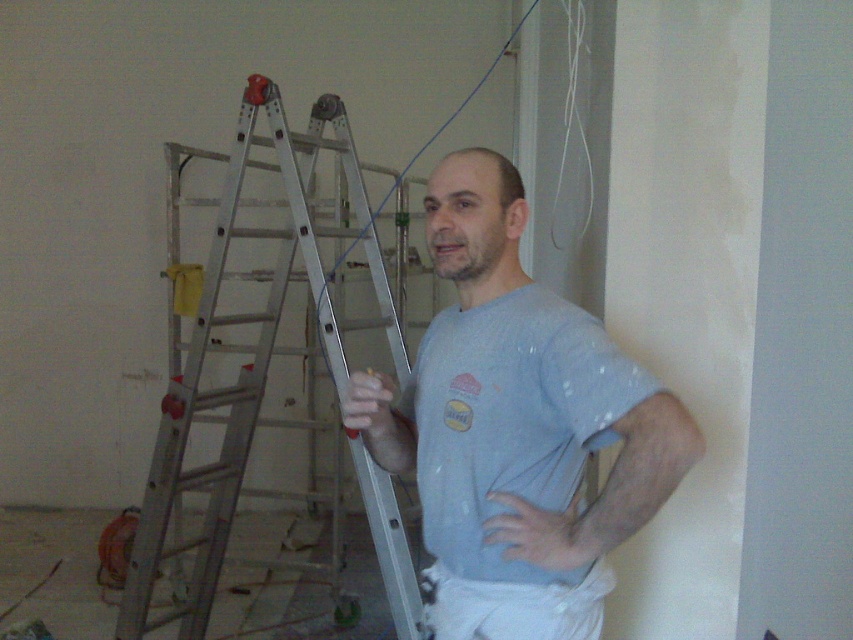
You are an inspector checking the wall for paint consistency. You notice two points on the wall marked as point (474,166) and point (212,204). Which point is closer to you?

Point (474,166) is closer to the viewer than point (212,204).